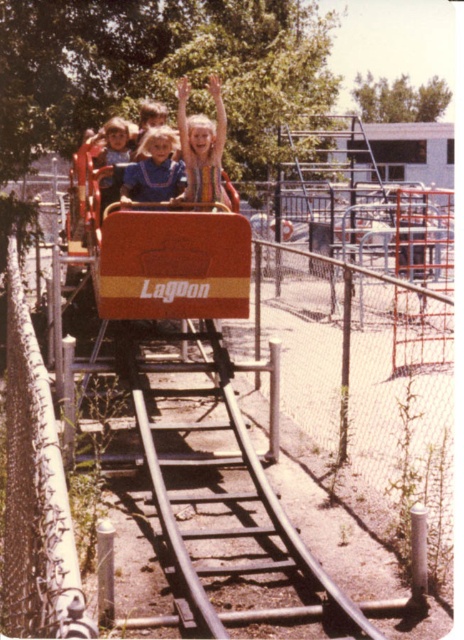
Question: Is striped dress at center below matte blue shirt at center?

Choices:
 (A) no
 (B) yes

Answer: (A)

Question: Can you confirm if striped dress at center is positioned to the left of blonde hair at center?

Choices:
 (A) yes
 (B) no

Answer: (B)

Question: Which point appears closest to the camera in this image?

Choices:
 (A) (217, 177)
 (B) (130, 180)

Answer: (A)

Question: Among these points, which one is nearest to the camera?

Choices:
 (A) (212, 177)
 (B) (105, 177)

Answer: (A)

Question: Based on their relative distances, which object is nearer to the blonde hair at center?

Choices:
 (A) striped dress at center
 (B) matte blue shirt at center

Answer: (B)

Question: Can you confirm if matte blue shirt at center is positioned above blonde hair at center?

Choices:
 (A) yes
 (B) no

Answer: (B)